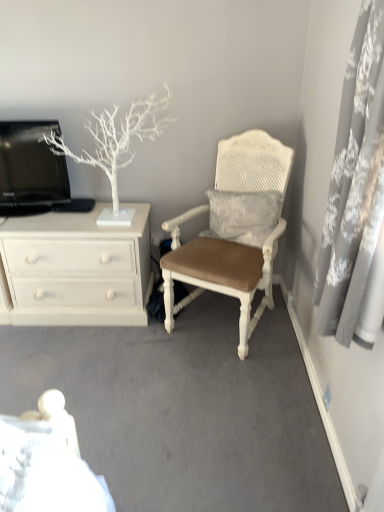
This screenshot has height=512, width=384. Identify the location of vacant space in white textured cushioned chair at center (from a real-world perspective). (214, 318).